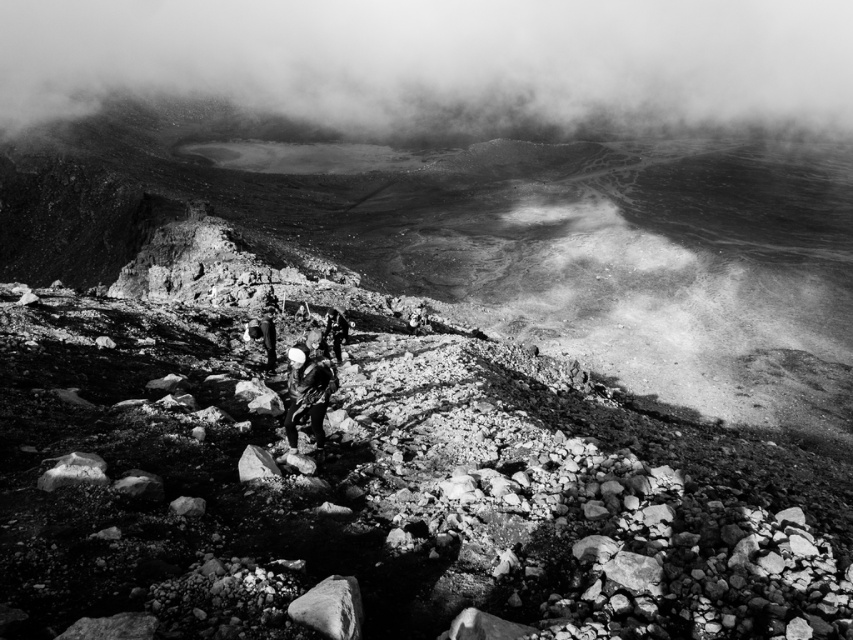
In the scene shown: Does foggy mist at upper center have a greater width compared to smooth gray rock at lower left?

Correct, the width of foggy mist at upper center exceeds that of smooth gray rock at lower left.

Is foggy mist at upper center positioned before smooth gray rock at lower left?

No, it is not.

Image resolution: width=853 pixels, height=640 pixels. What are the coordinates of `foggy mist at upper center` in the screenshot? It's located at coord(436,60).

Who is shorter, smooth gray rock at center or dark fabric jacket at center?

smooth gray rock at center

Can you confirm if smooth gray rock at center is wider than dark fabric jacket at center?

No.

Does point (250, 476) lie in front of point (343, 316)?

Yes, it is in front of point (343, 316).

Where is `smooth gray rock at center`? The image size is (853, 640). smooth gray rock at center is located at coordinates (256, 465).

Is dark gray fabric backpack at center wider than smooth gray rock at lower left?

No, dark gray fabric backpack at center is not wider than smooth gray rock at lower left.

Who is higher up, dark gray fabric backpack at center or smooth gray rock at lower left?

dark gray fabric backpack at center is above.

Which is behind, point (294, 394) or point (42, 484)?

Positioned behind is point (294, 394).

The height and width of the screenshot is (640, 853). I want to click on dark gray fabric backpack at center, so click(x=306, y=396).